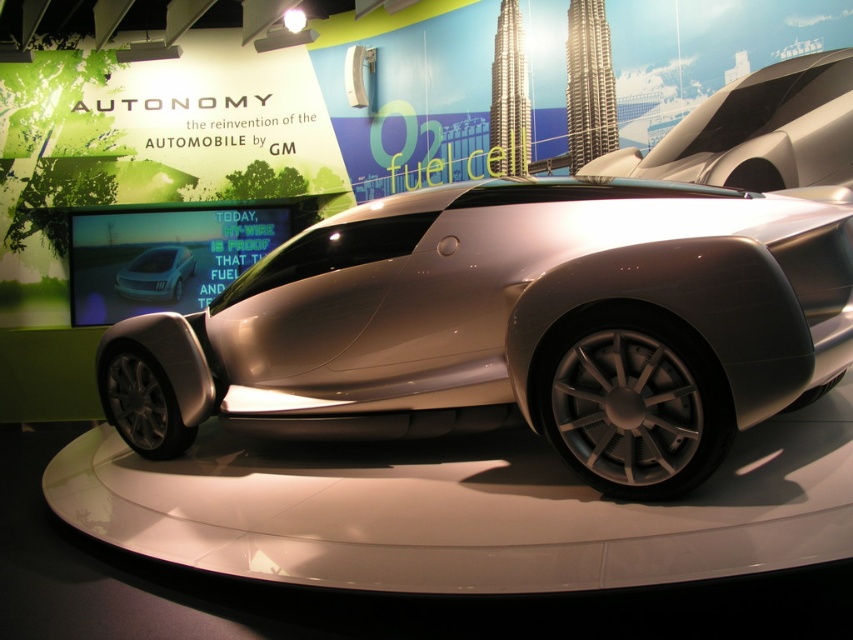
Question: Which object appears farthest from the camera in this image?

Choices:
 (A) silver metallic car at center
 (B) satin silver car at center

Answer: (B)

Question: In this image, where is silver metallic car at center located relative to satin silver car at center?

Choices:
 (A) below
 (B) above

Answer: (A)

Question: Which point is closer to the camera taking this photo?

Choices:
 (A) (186, 266)
 (B) (788, 310)

Answer: (B)

Question: Is silver metallic car at center below satin silver car at center?

Choices:
 (A) yes
 (B) no

Answer: (A)

Question: Does silver metallic car at center have a greater width compared to satin silver car at center?

Choices:
 (A) no
 (B) yes

Answer: (B)

Question: Which point is closer to the camera taking this photo?

Choices:
 (A) (532, 282)
 (B) (149, 285)

Answer: (A)